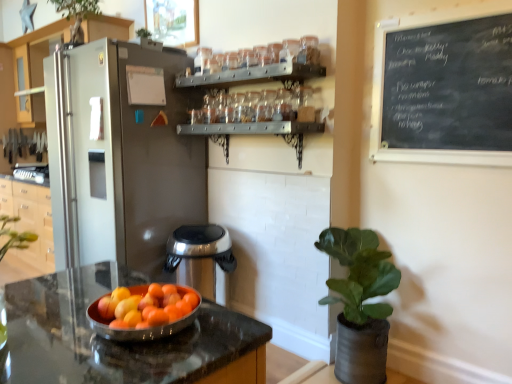
I want to click on free space to the left of shiny metallic bowl at center, so [65, 306].